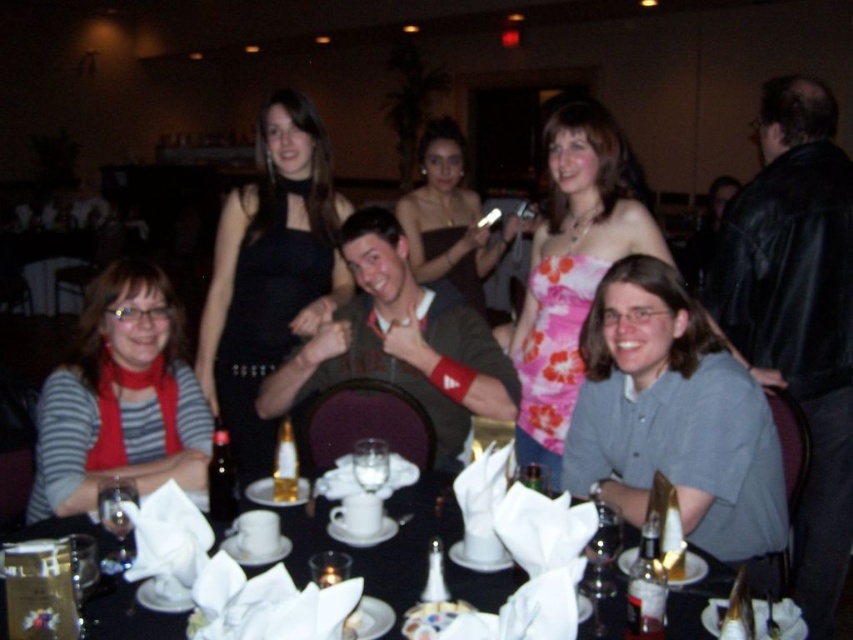
Question: Observing the image, what is the correct spatial positioning of pink floral dress at center in reference to white porcelain cup at center?

Choices:
 (A) above
 (B) below

Answer: (A)

Question: Among these objects, which one is farthest from the camera?

Choices:
 (A) black satin dress at center
 (B) matte black dress at center
 (C) pink floral dress at center
 (D) matte black dress at left

Answer: (B)

Question: Does matte black dress at center have a smaller size compared to white porcelain cup at center?

Choices:
 (A) yes
 (B) no

Answer: (B)

Question: Does matte black dress at left have a lesser width compared to white napkin at lower center?

Choices:
 (A) yes
 (B) no

Answer: (A)

Question: Which object appears closest to the camera in this image?

Choices:
 (A) white napkin at lower center
 (B) white porcelain cup at center
 (C) matte black dress at left
 (D) matte black dress at center

Answer: (A)

Question: Which of these objects is positioned closest to the white napkin at lower center?

Choices:
 (A) pink floral dress at center
 (B) black satin dress at center

Answer: (A)